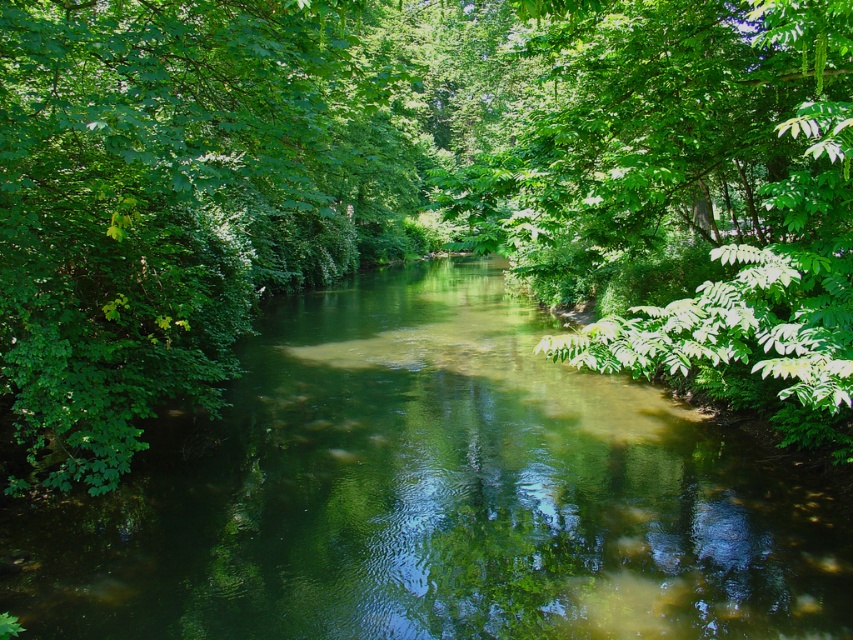
Question: Does green translucent water at center have a lesser width compared to green leafy tree at left?

Choices:
 (A) no
 (B) yes

Answer: (A)

Question: Which point is farther to the camera?

Choices:
 (A) green leafy tree at left
 (B) green translucent water at center

Answer: (B)

Question: Is green translucent water at center further to the viewer compared to green leafy tree at left?

Choices:
 (A) yes
 (B) no

Answer: (A)

Question: Among these objects, which one is farthest from the camera?

Choices:
 (A) green translucent water at center
 (B) green leafy tree at left

Answer: (A)

Question: Is green translucent water at center to the left of green leafy tree at left from the viewer's perspective?

Choices:
 (A) yes
 (B) no

Answer: (B)